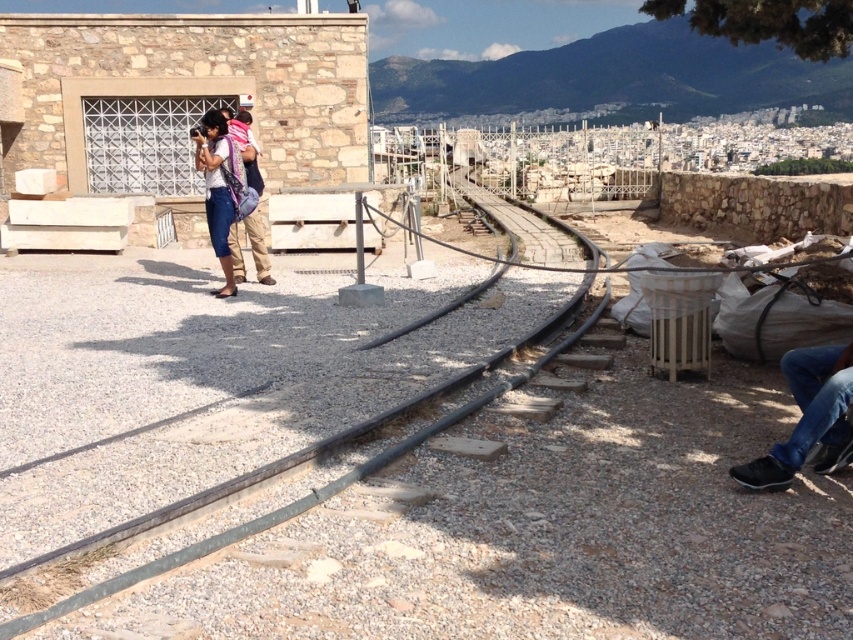
Question: Which of these objects is positioned farthest from the black rubber train track at center?

Choices:
 (A) matte blue pants at center
 (B) black leather shoes at lower right

Answer: (A)

Question: From the image, what is the correct spatial relationship of black rubber train track at center in relation to matte blue pants at center?

Choices:
 (A) below
 (B) above

Answer: (B)

Question: Based on their relative distances, which object is nearer to the black rubber train track at center?

Choices:
 (A) black leather shoes at lower right
 (B) matte blue pants at center

Answer: (A)

Question: Can you confirm if black rubber train track at center is smaller than matte blue pants at center?

Choices:
 (A) no
 (B) yes

Answer: (A)

Question: Which point appears closest to the camera in this image?

Choices:
 (A) (822, 429)
 (B) (605, 288)

Answer: (A)

Question: Is black rubber train track at center wider than matte blue pants at center?

Choices:
 (A) no
 (B) yes

Answer: (B)